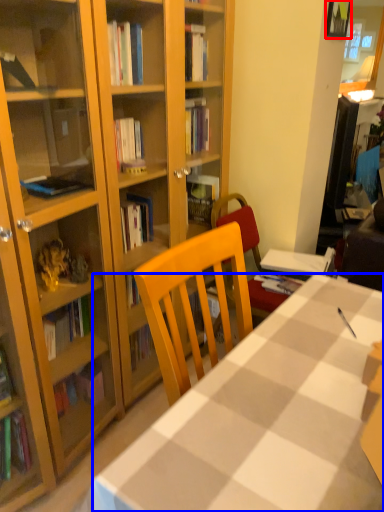
Question: Among these objects, which one is farthest to the camera, picture frame (highlighted by a red box) or desk (highlighted by a blue box)?

Choices:
 (A) picture frame
 (B) desk

Answer: (A)